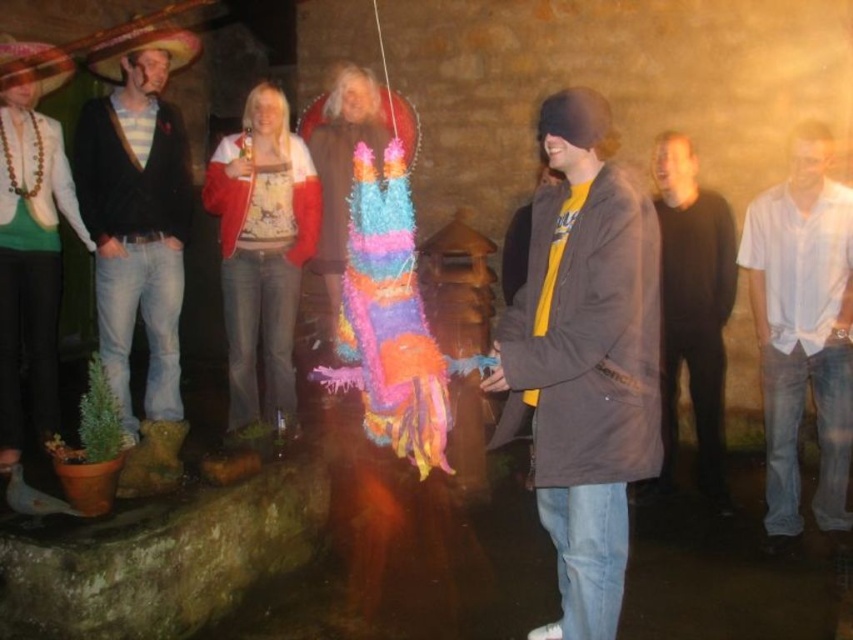
Does black matte jacket at center have a larger size compared to matte brown sombrero at upper left?

Yes.

Who is lower down, black matte jacket at center or matte brown sombrero at upper left?

black matte jacket at center is lower down.

Who is more distant from viewer, (726,248) or (97,61)?

The point (97,61) is behind.

The image size is (853, 640). I want to click on black matte jacket at center, so click(692, 310).

Can you confirm if black matte jacket at center is shorter than red felt sombrero at upper left?

In fact, black matte jacket at center may be taller than red felt sombrero at upper left.

Can you confirm if black matte jacket at center is smaller than red felt sombrero at upper left?

Incorrect, black matte jacket at center is not smaller in size than red felt sombrero at upper left.

Image resolution: width=853 pixels, height=640 pixels. I want to click on black matte jacket at center, so click(692, 310).

Identify the location of black matte jacket at center. (692, 310).

Who is higher up, gray suede jacket at center or striped shirt at left?

striped shirt at left is above.

Who is shorter, gray suede jacket at center or striped shirt at left?

With less height is gray suede jacket at center.

Where is `gray suede jacket at center`? gray suede jacket at center is located at coordinates tap(584, 360).